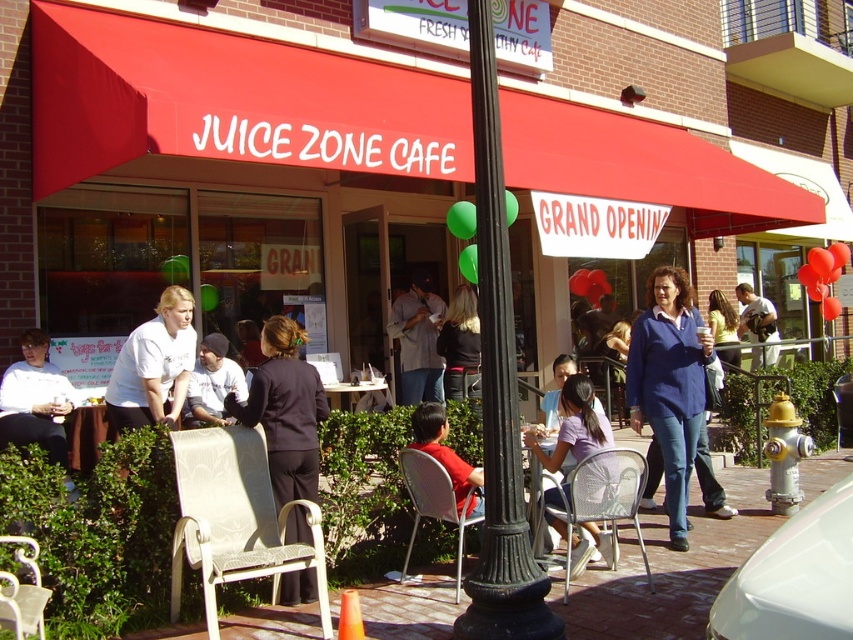
Does point (683, 456) come behind point (65, 413)?

No, it is not.

Does blue cotton shirt at center appear under white t-shirt at left?

No.

Does point (680, 344) come in front of point (0, 448)?

Yes, it is in front of point (0, 448).

Find the location of a particular element. The height and width of the screenshot is (640, 853). blue cotton shirt at center is located at coordinates (670, 385).

Identify the location of light brown leather jacket at center. (416, 340).

Measure the distance between light brown leather jacket at center and camera.

A distance of 9.48 meters exists between light brown leather jacket at center and camera.

Is point (416, 305) closer to viewer compared to point (9, 586)?

No, it is not.

Find the location of a particular element. The width and height of the screenshot is (853, 640). light brown leather jacket at center is located at coordinates (416, 340).

Can you confirm if wooden table at center is positioned above white plastic table at center?

Actually, wooden table at center is below white plastic table at center.

Is wooden table at center to the left of white plastic table at center from the viewer's perspective?

Yes, wooden table at center is to the left of white plastic table at center.

Does point (102, 429) lie in front of point (376, 385)?

Yes.

At what (x,y) coordinates should I click in order to perform the action: click on wooden table at center. Please return your answer as a coordinate pair (x, y). Image resolution: width=853 pixels, height=640 pixels. Looking at the image, I should click on (86, 435).